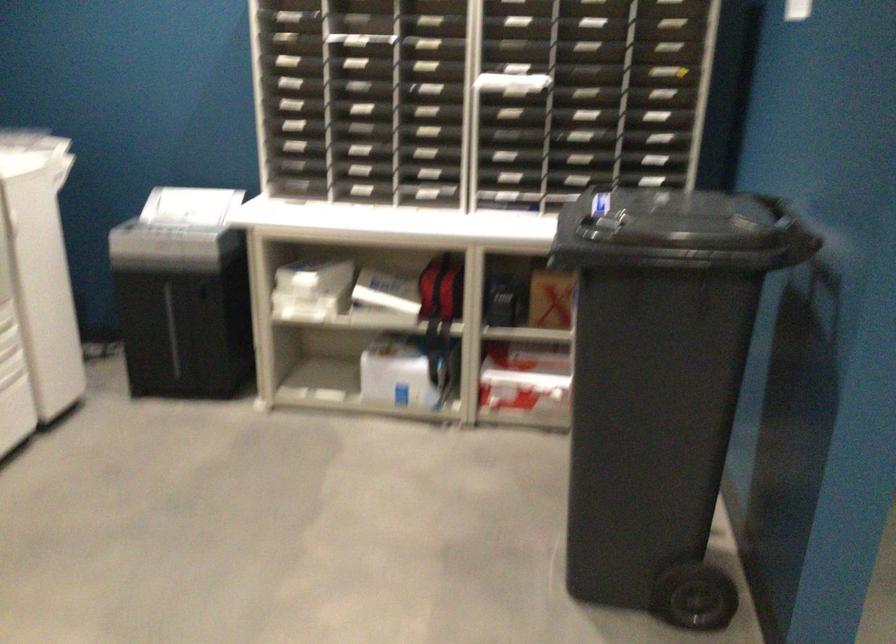
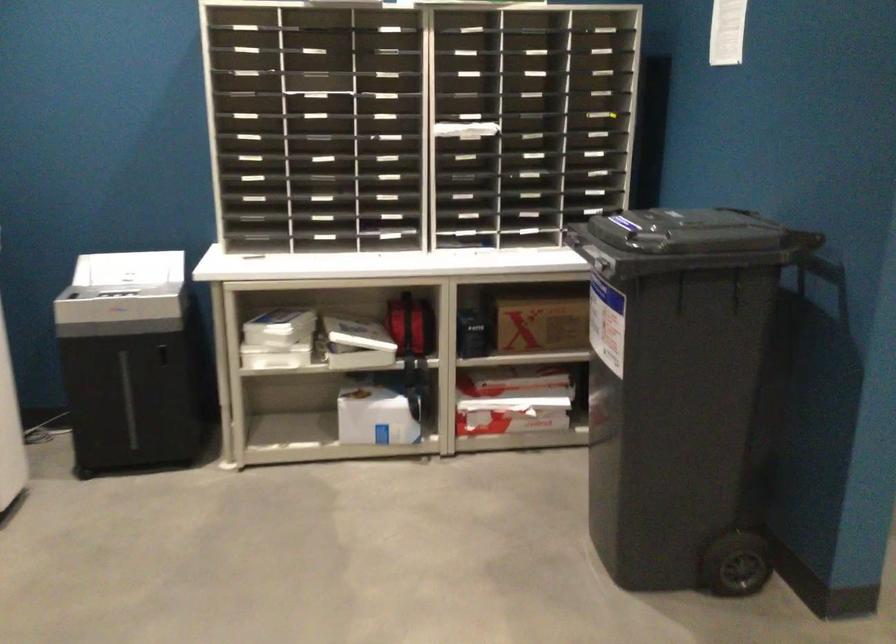
Question: The camera is either moving clockwise (left) or counter-clockwise (right) around the object. The first image is from the beginning of the video and the second image is from the end. Is the camera moving left or right when shooting the video?

Choices:
 (A) Left
 (B) Right

Answer: (A)